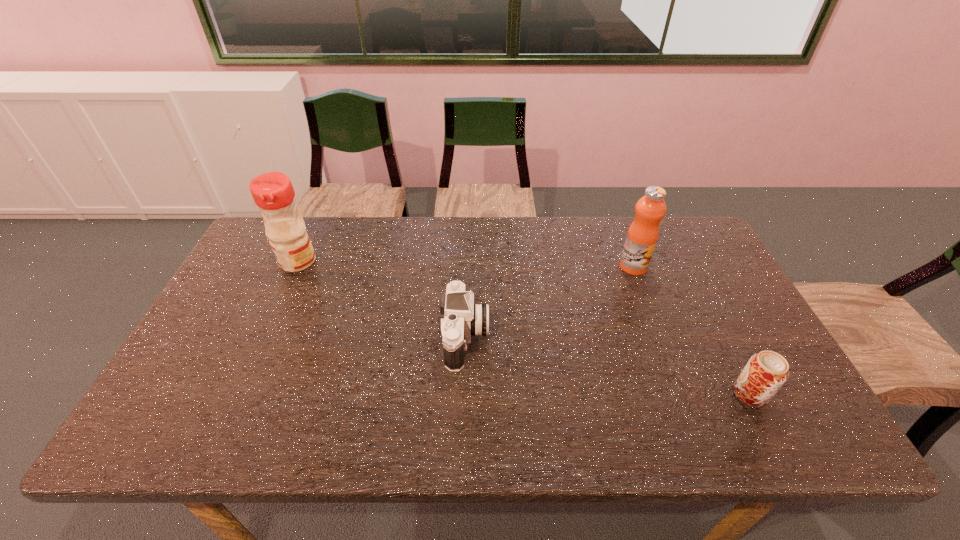
You are a GUI agent. You are given a task and a screenshot of the screen. Output one action in this format:
    pyautogui.click(x=<x>, y=<y>)
    Task: Click on the leftmost object
    
    Given the screenshot: What is the action you would take?
    pyautogui.click(x=273, y=193)

At what (x,y) coordinates should I click in order to perform the action: click on fruit juice. Please return your answer as a coordinate pair (x, y). The height and width of the screenshot is (540, 960). Looking at the image, I should click on (643, 233).

Where is `the second object from left to right`? Image resolution: width=960 pixels, height=540 pixels. the second object from left to right is located at coordinates (462, 319).

Where is `camera`? The width and height of the screenshot is (960, 540). camera is located at coordinates click(x=462, y=319).

Where is `the rightmost object`? The height and width of the screenshot is (540, 960). the rightmost object is located at coordinates (764, 374).

This screenshot has height=540, width=960. I want to click on beer can, so click(764, 374).

Image resolution: width=960 pixels, height=540 pixels. What are the coordinates of `free space located on the front of the condiment` in the screenshot? It's located at (276, 308).

Where is `vacant space situated on the front of the third object from left to right`? The height and width of the screenshot is (540, 960). vacant space situated on the front of the third object from left to right is located at coordinates click(x=674, y=374).

I want to click on blank area located on the left of the camera, so click(x=324, y=338).

Find the location of a particular element. free spot located 0.300m on the left of the nearest object is located at coordinates (606, 394).